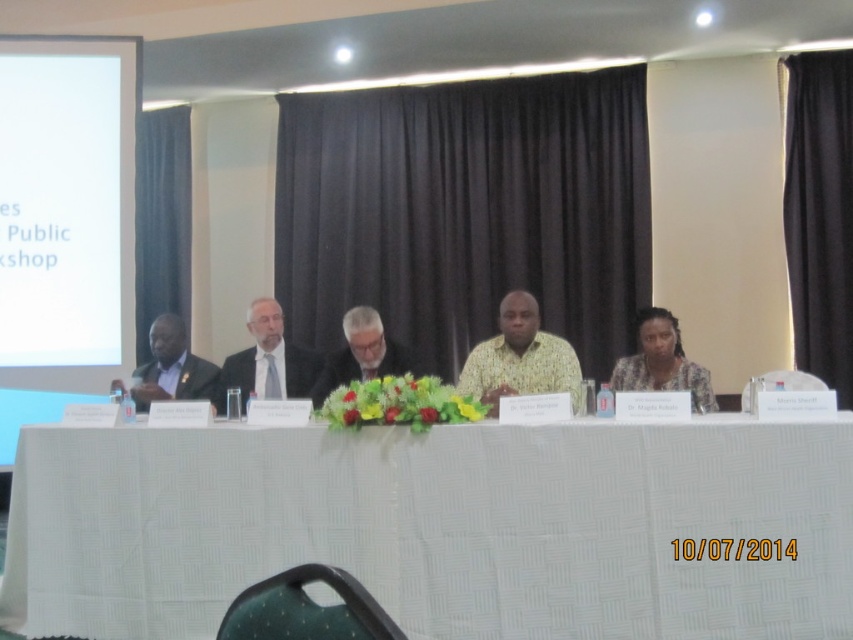
Which is more to the right, black fabric curtain at left or matte black dress at center?

From the viewer's perspective, matte black dress at center appears more on the right side.

Image resolution: width=853 pixels, height=640 pixels. What do you see at coordinates (161, 220) in the screenshot?
I see `black fabric curtain at left` at bounding box center [161, 220].

Where is `black fabric curtain at left`? The image size is (853, 640). black fabric curtain at left is located at coordinates (161, 220).

Is black fabric curtain at right below matte black suit at center?

No, black fabric curtain at right is not below matte black suit at center.

Does black fabric curtain at right have a larger size compared to matte black suit at center?

Yes.

Identify the location of black fabric curtain at right. (819, 214).

Based on the photo, which is below, yellow textured shirt at center or matte black suit at left?

matte black suit at left

Which is in front, point (553, 364) or point (152, 321)?

Point (553, 364)

This screenshot has height=640, width=853. Find the location of `yellow textured shirt at center`. yellow textured shirt at center is located at coordinates (520, 358).